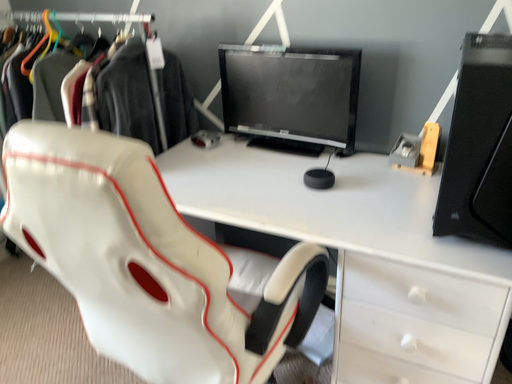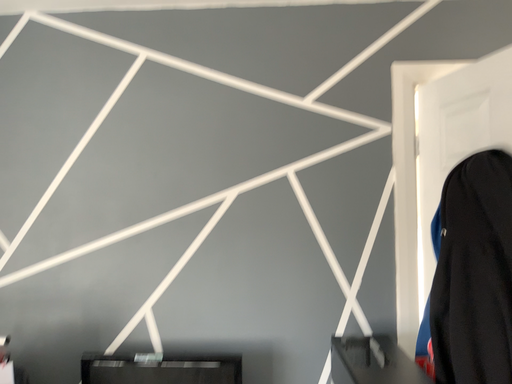
Question: Which way did the camera rotate in the video?

Choices:
 (A) rotated right
 (B) rotated left

Answer: (A)